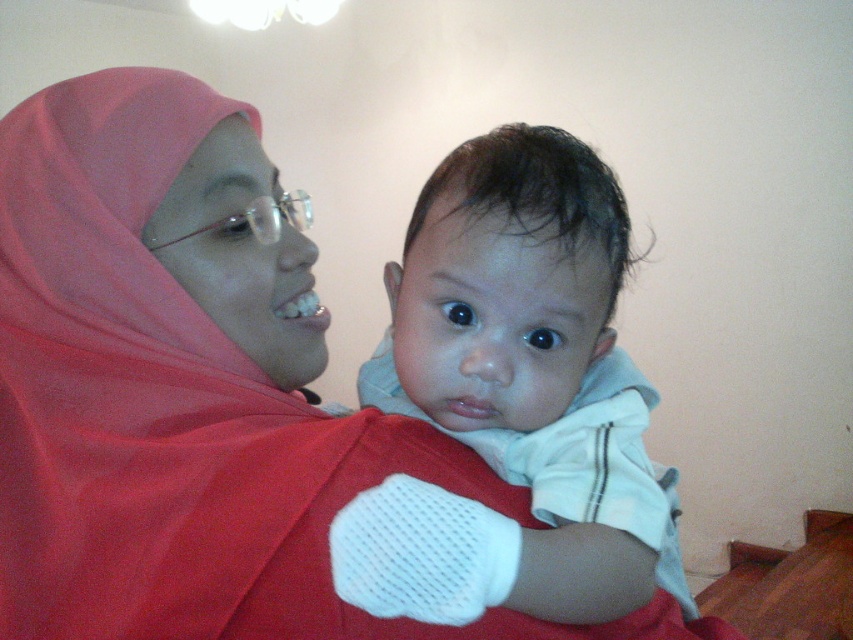
Question: Which of the following is the farthest from the observer?

Choices:
 (A) matte red hijab at center
 (B) white soft fabric baby at center

Answer: (A)

Question: Which object appears closest to the camera in this image?

Choices:
 (A) matte red hijab at center
 (B) white soft fabric baby at center

Answer: (B)

Question: From the image, what is the correct spatial relationship of matte red hijab at center in relation to white soft fabric baby at center?

Choices:
 (A) right
 (B) left

Answer: (B)

Question: Does matte red hijab at center come behind white soft fabric baby at center?

Choices:
 (A) yes
 (B) no

Answer: (A)

Question: Does matte red hijab at center have a lesser width compared to white soft fabric baby at center?

Choices:
 (A) no
 (B) yes

Answer: (A)